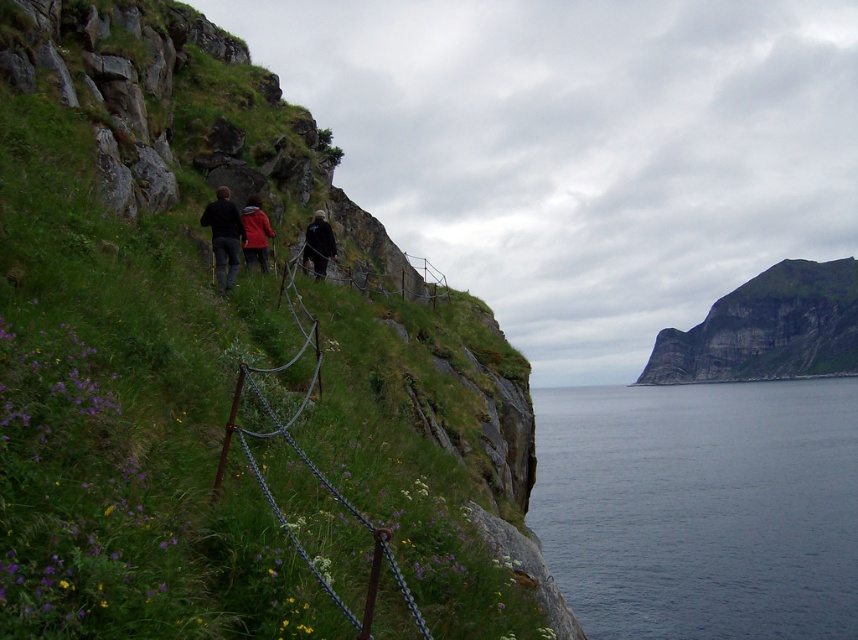
Question: Does rugged rock cliff at upper right have a larger size compared to red jacket at center?

Choices:
 (A) no
 (B) yes

Answer: (B)

Question: Where is blue water at lower right located in relation to dark blue jeans at center in the image?

Choices:
 (A) below
 (B) above

Answer: (A)

Question: Which point is farther to the camera?

Choices:
 (A) green grassy hillside at upper left
 (B) dark blue jacket at center

Answer: (B)

Question: Which object is the closest to the blue water at lower right?

Choices:
 (A) rugged rock cliff at upper right
 (B) red jacket at center
 (C) dark blue jeans at center

Answer: (B)

Question: Among these objects, which one is farthest from the camera?

Choices:
 (A) red jacket at center
 (B) green grassy hillside at upper left
 (C) dark blue jacket at center
 (D) dark blue jeans at center

Answer: (C)

Question: Can you confirm if green grassy hillside at upper left is positioned to the right of dark blue jeans at center?

Choices:
 (A) yes
 (B) no

Answer: (A)